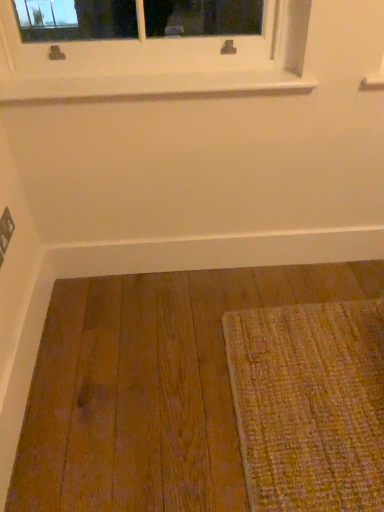
The width and height of the screenshot is (384, 512). Find the location of `free space above white smooth window sill at upper center (from a real-world perspective)`. free space above white smooth window sill at upper center (from a real-world perspective) is located at coordinates (164, 72).